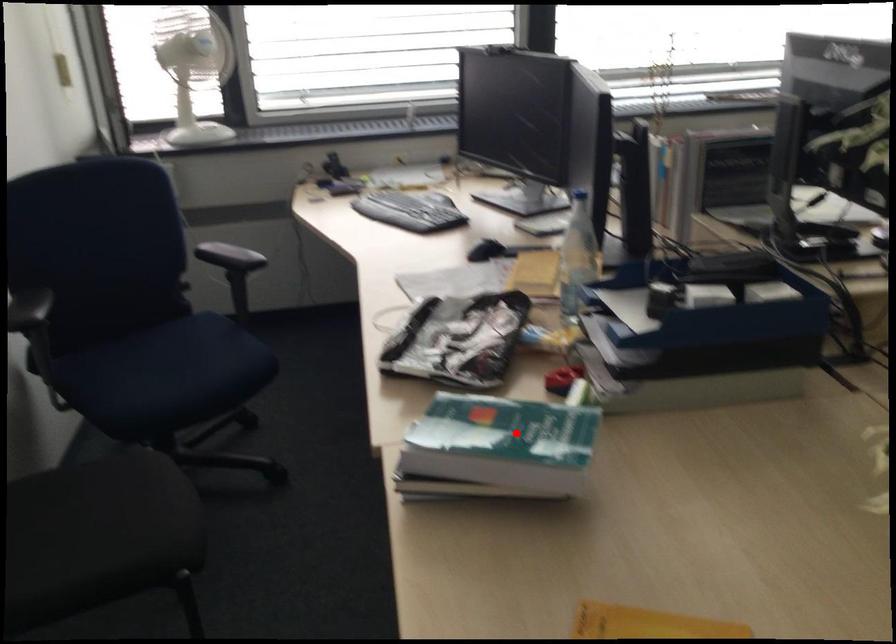
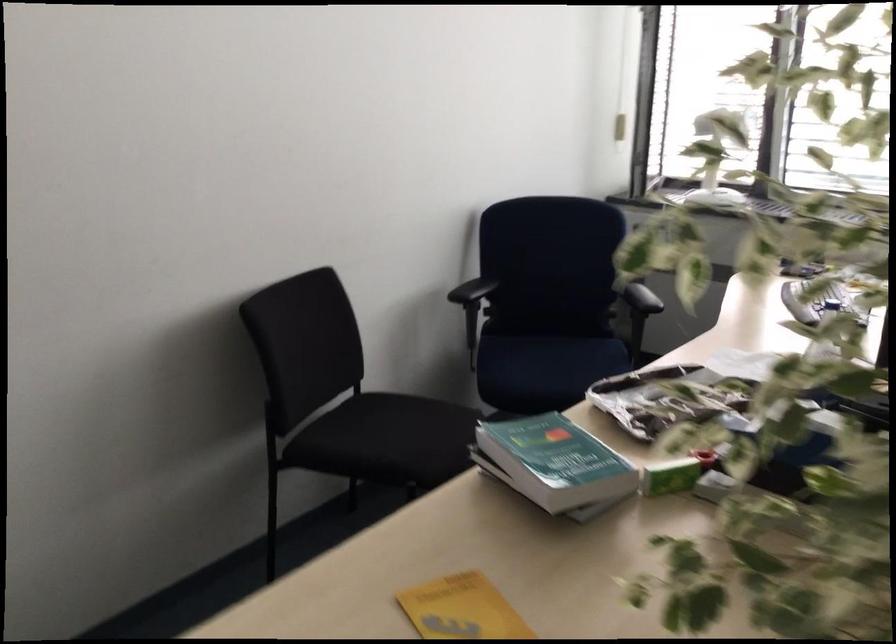
Question: I am providing you with two images of the same scene from different viewpoints. Image1 has a red point marked. In image2, the corresponding 3D location appears at what relative position? Reply with the corresponding letter.

Choices:
 (A) Closer
 (B) Farther

Answer: (B)